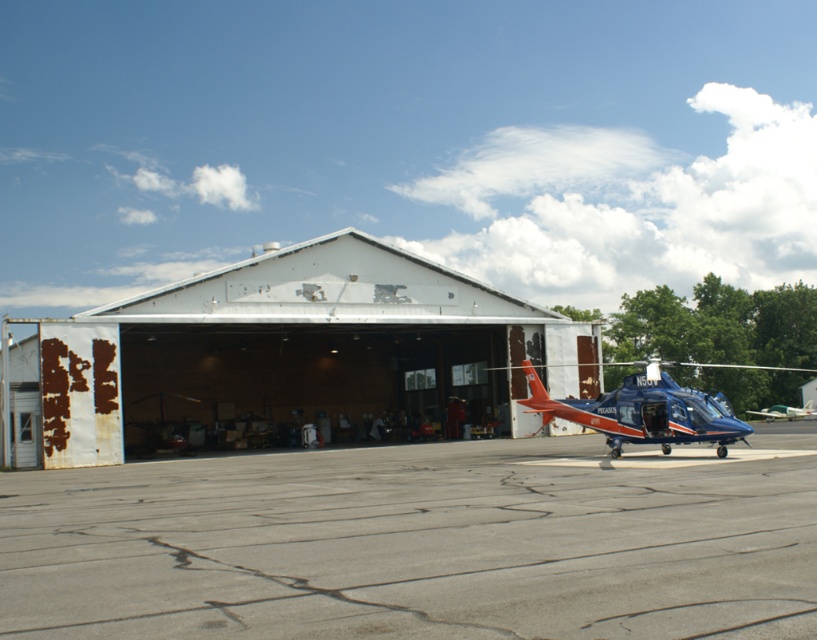
You are a pilot standing on the tarmac and want to enter the hangar. Which object, the white matte hangar at center or the blue metallic helicopter at center, is closer to you?

The blue metallic helicopter at center is closer to you since the white matte hangar at center is further away.

You are a pilot who just landed your helicopter on the gray concrete tarmac at center. You need to enter the white matte hangar at center to refuel. Which direction should you move your helicopter to reach the hangar?

The gray concrete tarmac at center is in front of the white matte hangar at center, so you should move your helicopter backward to reach the hangar.